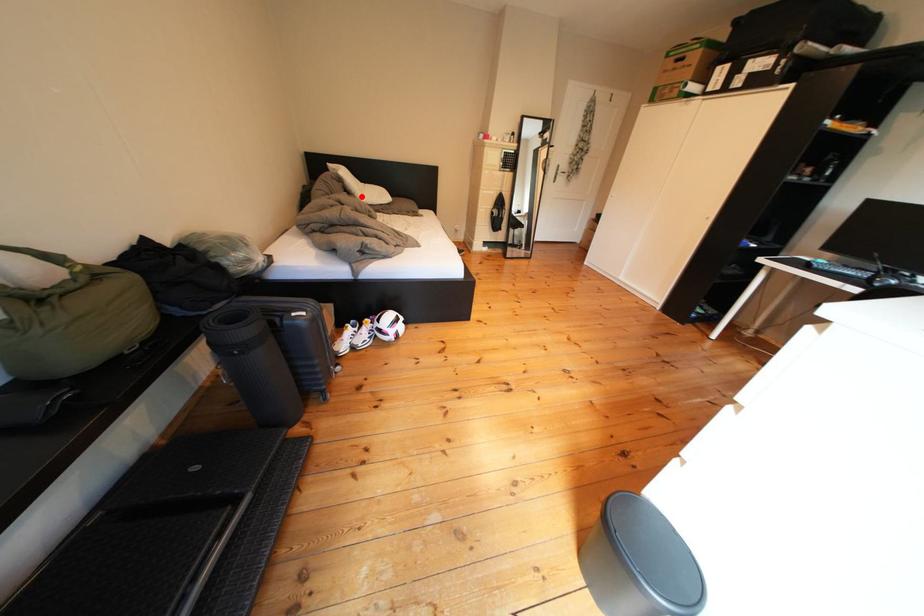
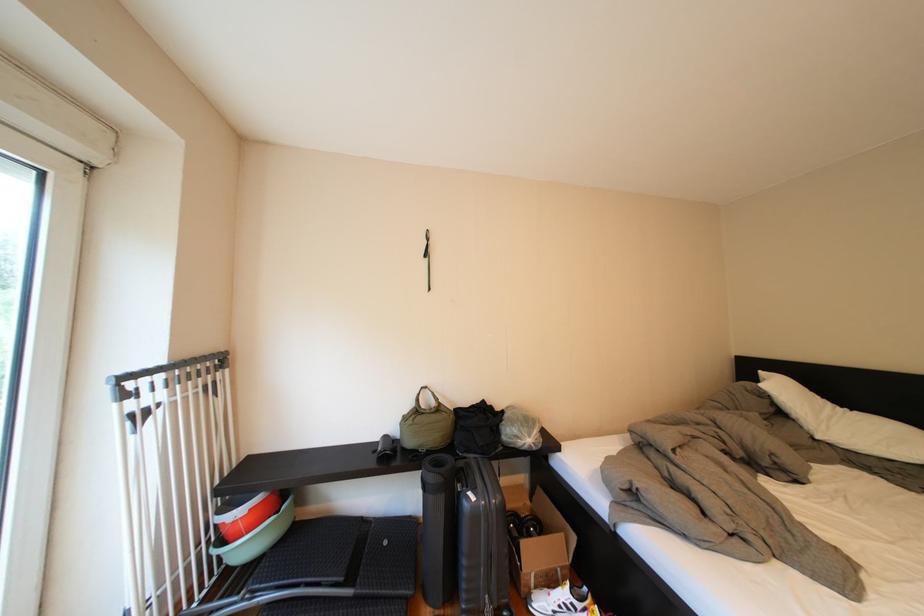
Where in the second image is the point corresponding to the highlighted location from the first image?

(795, 419)